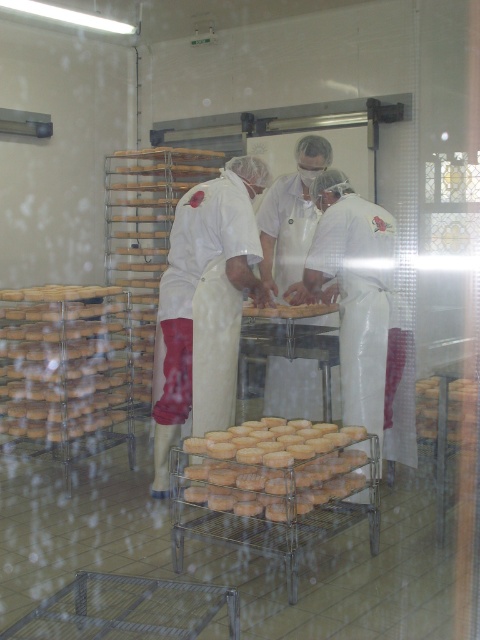
Which of these two, golden brown doughnuts at left or brown crumbly bread at center, stands shorter?

With less height is brown crumbly bread at center.

What do you see at coordinates (62, 360) in the screenshot? The image size is (480, 640). I see `golden brown doughnuts at left` at bounding box center [62, 360].

Find the location of a particular element. The height and width of the screenshot is (640, 480). golden brown doughnuts at left is located at coordinates (62, 360).

How far apart are white smooth uniform at center and brown crumbly bread at center?

white smooth uniform at center and brown crumbly bread at center are 1.12 meters apart.

You are a GUI agent. You are given a task and a screenshot of the screen. Output one action in this format:
    pyautogui.click(x=<x>, y=<y>)
    Task: Click on the white smooth uniform at center
    
    Given the screenshot: What is the action you would take?
    pyautogui.click(x=228, y=257)

What are the coordinates of `white smooth uniform at center` in the screenshot? It's located at click(228, 257).

At what (x,y) coordinates should I click in order to perform the action: click on white smooth uniform at center. Please return your answer as a coordinate pair (x, y). Looking at the image, I should click on click(x=228, y=257).

Which is in front, point (124, 394) or point (339, 456)?

Point (339, 456) is in front.

Consider the image. Is golden brown doughnuts at left closer to camera compared to golden brown crumbly pastry at center?

No, golden brown doughnuts at left is behind golden brown crumbly pastry at center.

At what (x,y) coordinates should I click in order to perform the action: click on golden brown doughnuts at left. Please return your answer as a coordinate pair (x, y). Looking at the image, I should click on (62, 360).